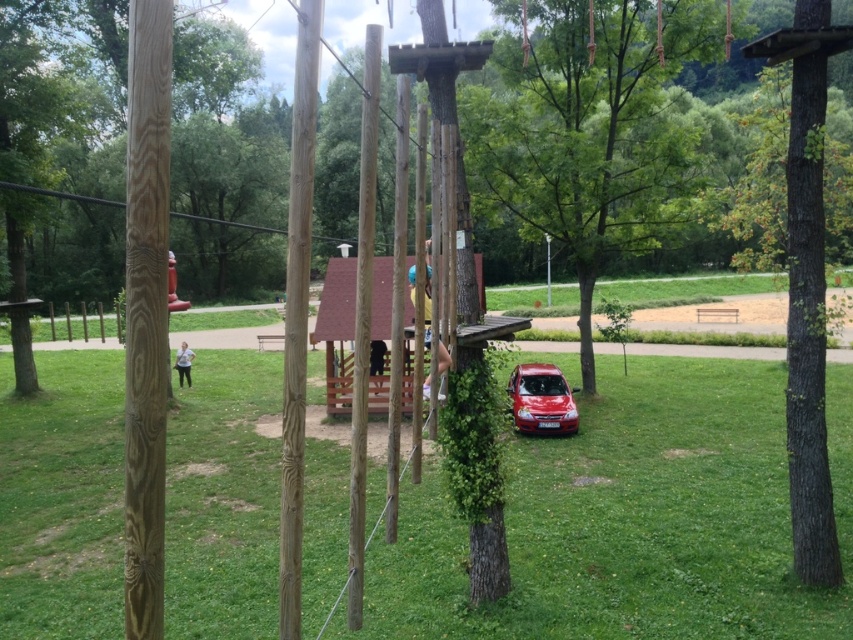
You are standing at the origin point of the coordinate system. You want to walk to the green grass at lower center. What coordinates should you walk towards?

You should walk towards the coordinates point at (631, 518) to reach the green grass at lower center.

You are a painter standing in the middle of the outdoor recreational area. You need to paint both the green rough bark tree at center and the smooth wood pole at center. Which object should you paint first if you want to start with the shorter one?

The green rough bark tree at center is not as tall as the smooth wood pole at center, so you should paint the green rough bark tree at center first since it is shorter.